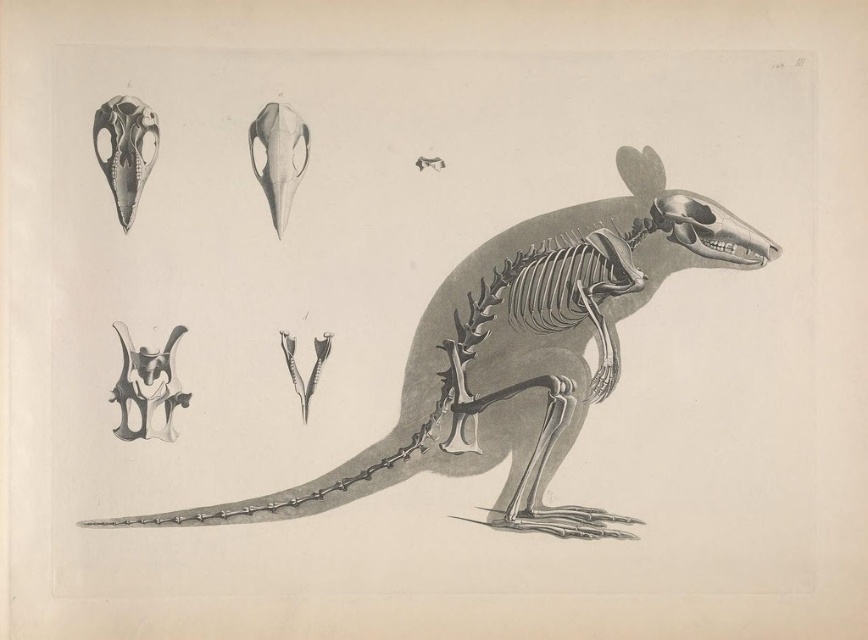
Question: Which point is farther to the camera?

Choices:
 (A) smooth gray bone at lower left
 (B) matte black skull at upper left
 (C) gray bone skeleton at center

Answer: (C)

Question: Is matte black skull at upper left bigger than smooth gray skull at upper center?

Choices:
 (A) no
 (B) yes

Answer: (B)

Question: Does smooth gray bone at lower left have a larger size compared to matte black skull at upper left?

Choices:
 (A) yes
 (B) no

Answer: (B)

Question: Does gray bone skeleton at center appear on the left side of matte black skull at upper left?

Choices:
 (A) yes
 (B) no

Answer: (B)

Question: Among these objects, which one is farthest from the camera?

Choices:
 (A) smooth gray bone at lower left
 (B) smooth gray skull at upper center
 (C) gray bone skeleton at center
 (D) matte black skull at upper left

Answer: (B)

Question: Which of the following is the closest to the observer?

Choices:
 (A) (122, 166)
 (B) (155, 364)
 (C) (668, 228)

Answer: (A)